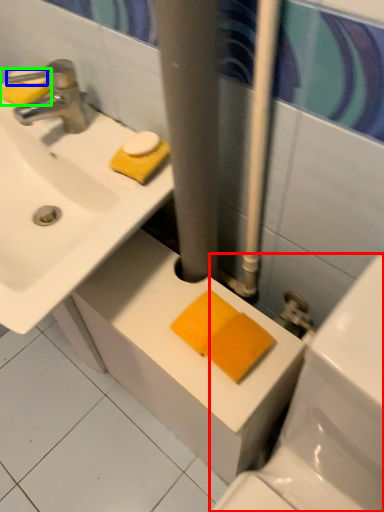
Question: Which object is positioned farthest from toilet (highlighted by a red box)? Select from soap (highlighted by a blue box) and soap (highlighted by a green box).

Choices:
 (A) soap
 (B) soap

Answer: (A)